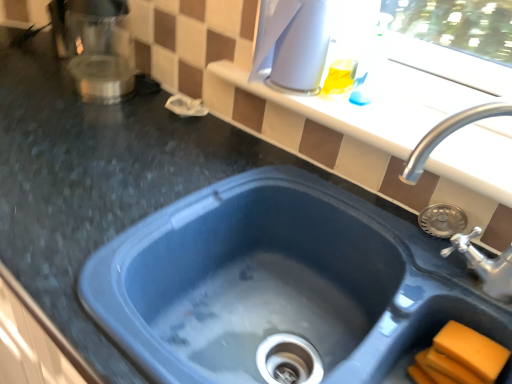
Question: From the image's perspective, would you say blue plastic sink at center, the 1th sink viewed from the left, is positioned over white glossy kettle at upper center, placed as the 2th appliance when sorted from left to right?

Choices:
 (A) yes
 (B) no

Answer: (B)

Question: Is blue plastic sink at center, which is the second sink in right-to-left order, to the left of white glossy kettle at upper center, the 1th appliance from the right, from the viewer's perspective?

Choices:
 (A) no
 (B) yes

Answer: (B)

Question: Can you confirm if blue plastic sink at center, the 1th sink viewed from the left, is shorter than white glossy kettle at upper center, the 1th appliance from the right?

Choices:
 (A) yes
 (B) no

Answer: (A)

Question: Does blue plastic sink at center, the 1th sink viewed from the left, have a greater width compared to white glossy kettle at upper center, placed as the 2th appliance when sorted from left to right?

Choices:
 (A) no
 (B) yes

Answer: (B)

Question: Is the position of blue plastic sink at center, which is the second sink in right-to-left order, more distant than that of white glossy kettle at upper center, placed as the 2th appliance when sorted from left to right?

Choices:
 (A) no
 (B) yes

Answer: (A)

Question: From a real-world perspective, relative to white glossy window sill at upper center, is orange sponge at lower right vertically above or below?

Choices:
 (A) below
 (B) above

Answer: (A)

Question: From the image's perspective, is orange sponge at lower right located above or below white glossy window sill at upper center?

Choices:
 (A) below
 (B) above

Answer: (A)

Question: Choose the correct answer: Is orange sponge at lower right inside white glossy window sill at upper center or outside it?

Choices:
 (A) outside
 (B) inside

Answer: (A)

Question: Is orange sponge at lower right taller or shorter than white glossy window sill at upper center?

Choices:
 (A) short
 (B) tall

Answer: (B)

Question: Relative to blue plastic sink at center, which is the second sink in right-to-left order, is satin silver coffee maker at upper left, which is the first appliance from left to right, in front or behind?

Choices:
 (A) behind
 (B) front

Answer: (A)

Question: Looking at the image, does satin silver coffee maker at upper left, which is the second appliance in right-to-left order, seem bigger or smaller compared to blue plastic sink at center, which is the second sink in right-to-left order?

Choices:
 (A) small
 (B) big

Answer: (A)

Question: Looking at their shapes, would you say satin silver coffee maker at upper left, which is the first appliance from left to right, is wider or thinner than blue plastic sink at center, the 1th sink viewed from the left?

Choices:
 (A) thin
 (B) wide

Answer: (A)

Question: From their relative heights in the image, would you say satin silver coffee maker at upper left, which is the first appliance from left to right, is taller or shorter than blue plastic sink at center, which is the second sink in right-to-left order?

Choices:
 (A) tall
 (B) short

Answer: (A)

Question: Is point (124, 238) closer or farther from the camera than point (508, 112)?

Choices:
 (A) farther
 (B) closer

Answer: (A)

Question: Is blue plastic sink at center, which is the second sink in right-to-left order, taller or shorter than blue plastic sink at upper right, positioned as the first sink in right-to-left order?

Choices:
 (A) short
 (B) tall

Answer: (A)